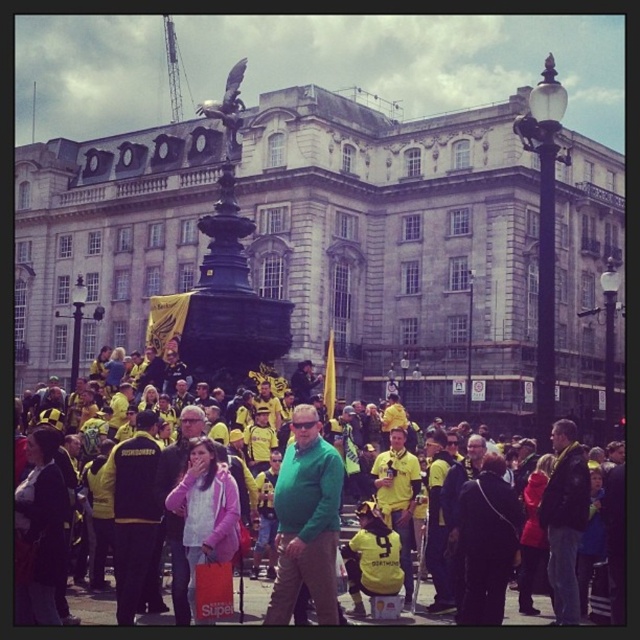
You are attending an event at the grand classical building and notice two attendees wearing a green matte shirt at center and a pink fabric jacket at center. From your perspective facing the building, which clothing item is positioned to the right of the other?

The green matte shirt at center is to the right of the pink fabric jacket at center.

You are a photographer standing in front of the grand building. You want to take a photo that includes both the stone statue at center and the yellow jersey at center. Which object will appear larger in the photo?

The stone statue at center will appear larger in the photo because it is much taller than the yellow jersey at center.

You are a photographer trying to capture a group photo of the dark blue leather jacket at lower right and the yellow jersey at center. Which clothing item should you focus on first to ensure it appears taller in the photo?

The yellow jersey at center should be focused on first because it is taller than the dark blue leather jacket at lower right, ensuring it appears taller in the photo.